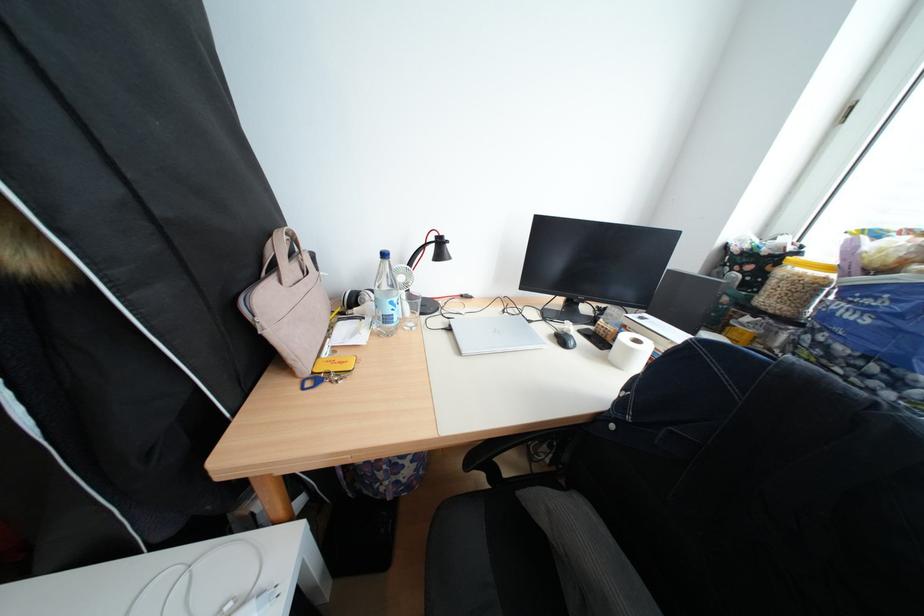
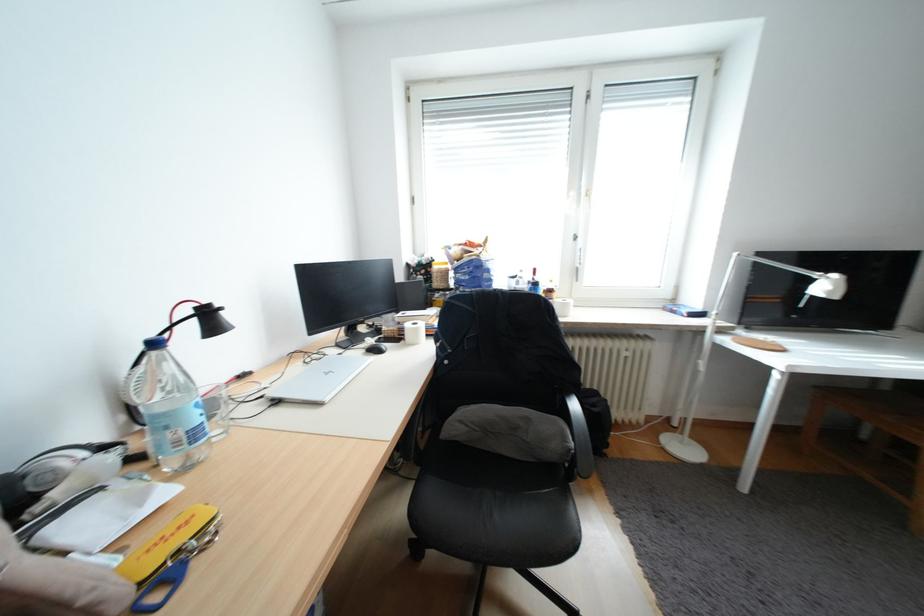
Question: The camera is either moving clockwise (left) or counter-clockwise (right) around the object. The first image is from the beginning of the video and the second image is from the end. Is the camera moving left or right when shooting the video?

Choices:
 (A) Left
 (B) Right

Answer: (A)